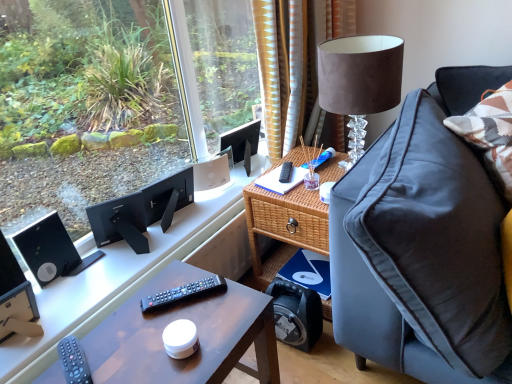
You are a GUI agent. You are given a task and a screenshot of the screen. Output one action in this format:
    pyautogui.click(x=<x>, y=<y>)
    Task: Click on the free point behind black plastic remote at center, marked as the 2th remote control in a back-to-front arrangement
    
    Given the screenshot: What is the action you would take?
    pyautogui.click(x=184, y=278)